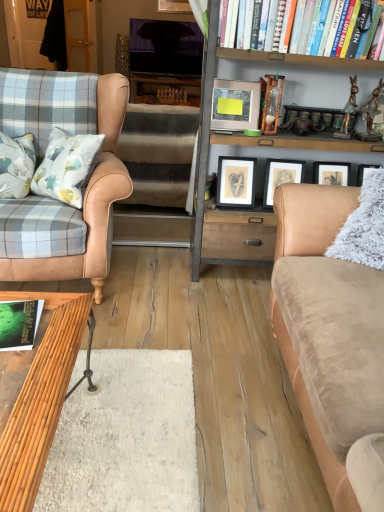
Question: Is matte silver picture frame at upper center, the 1th picture frame positioned from the back, completely or partially inside brown plush stair at center?

Choices:
 (A) yes
 (B) no

Answer: (B)

Question: Does brown plush stair at center come behind matte silver picture frame at upper center, the first picture frame viewed from the top?

Choices:
 (A) no
 (B) yes

Answer: (A)

Question: Can you confirm if brown plush stair at center is shorter than matte silver picture frame at upper center, the 1th picture frame positioned from the back?

Choices:
 (A) yes
 (B) no

Answer: (B)

Question: Is brown plush stair at center looking in the opposite direction of matte silver picture frame at upper center, the 1th picture frame positioned from the back?

Choices:
 (A) yes
 (B) no

Answer: (B)

Question: Is brown plush stair at center in front of matte silver picture frame at upper center, positioned as the first picture frame in left-to-right order?

Choices:
 (A) no
 (B) yes

Answer: (B)

Question: Is brown plush stair at center facing towards matte silver picture frame at upper center, the 1th picture frame positioned from the back?

Choices:
 (A) no
 (B) yes

Answer: (B)

Question: Is hardcover book at upper right, which is the second book from bottom to top, bigger than brown plush stair at center?

Choices:
 (A) yes
 (B) no

Answer: (B)

Question: Is hardcover book at upper right, the 1th book viewed from the right, further to the viewer compared to brown plush stair at center?

Choices:
 (A) no
 (B) yes

Answer: (A)

Question: From the image's perspective, is hardcover book at upper right, the 1th book viewed from the right, located beneath brown plush stair at center?

Choices:
 (A) no
 (B) yes

Answer: (A)

Question: Considering the relative sizes of hardcover book at upper right, acting as the 2th book starting from the left, and brown plush stair at center in the image provided, is hardcover book at upper right, acting as the 2th book starting from the left, wider than brown plush stair at center?

Choices:
 (A) no
 (B) yes

Answer: (A)

Question: From a real-world perspective, is hardcover book at upper right, placed as the first book when sorted from top to bottom, on brown plush stair at center?

Choices:
 (A) no
 (B) yes

Answer: (B)

Question: Does hardcover book at upper right, the 1th book in the back-to-front sequence, have a lesser width compared to brown plush stair at center?

Choices:
 (A) yes
 (B) no

Answer: (A)

Question: Would you say green matte book at lower left, the second book viewed from the right, is outside tan leather chair at left?

Choices:
 (A) yes
 (B) no

Answer: (A)